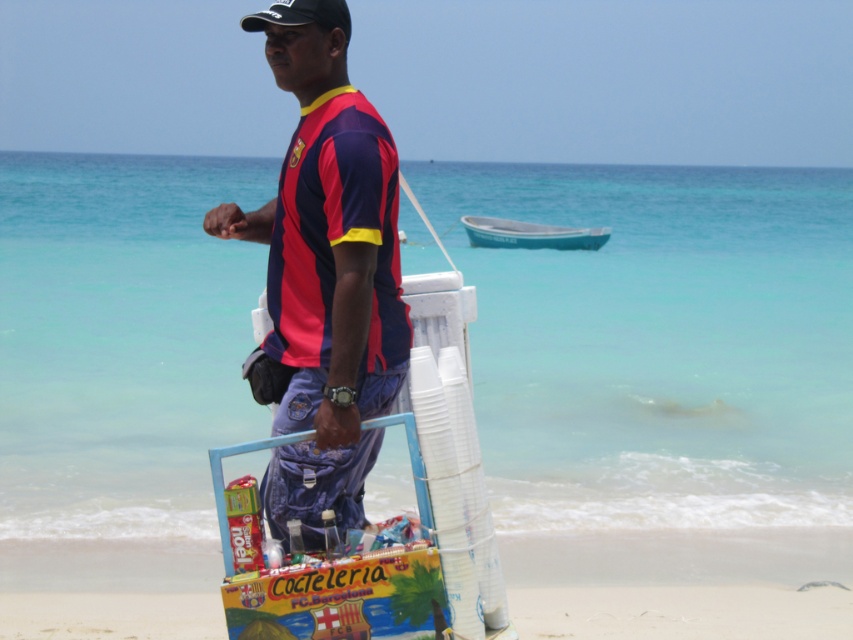
You are a customer at the beach and want to buy a drink from the vendor. You notice the matte red and blue jersey at center and the white plastic cups at center. Which item is taller?

The matte red and blue jersey at center is taller than the white plastic cups at center.

You are a tourist who wants to buy a drink from the vendor. You notice the matte red and blue jersey at center and the teal plastic boat at center. Which object is nearer to you as you approach the vendor?

The matte red and blue jersey at center is closer to the viewer than the teal plastic boat at center, so the jersey is nearer to you as you approach the vendor.